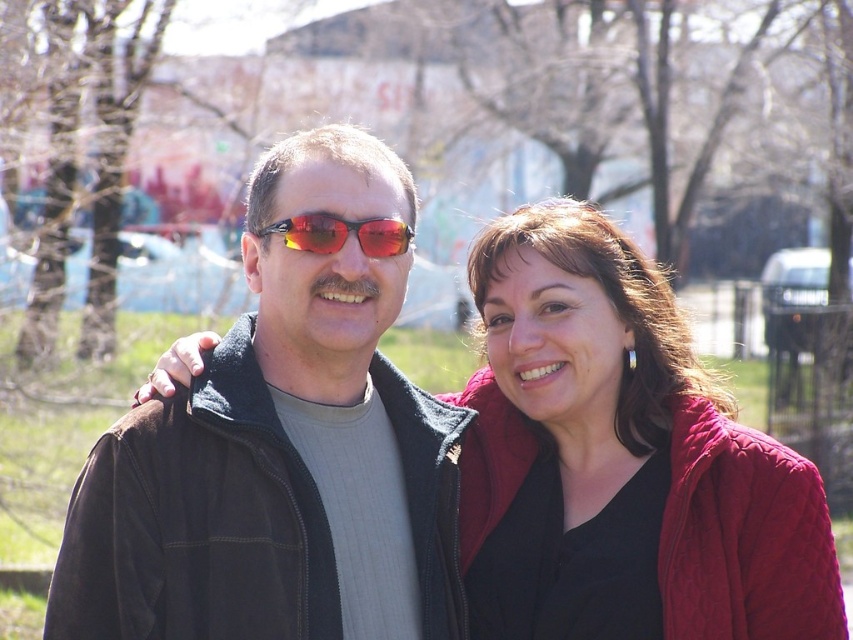
Is matte black jacket at center smaller than quilted red jacket at center?

Yes, matte black jacket at center is smaller than quilted red jacket at center.

Which is more to the left, matte black jacket at center or quilted red jacket at center?

From the viewer's perspective, matte black jacket at center appears more on the left side.

Between point (74, 602) and point (490, 568), which one is positioned in front?

Point (74, 602) is in front.

At what (x,y) coordinates should I click in order to perform the action: click on matte black jacket at center. Please return your answer as a coordinate pair (x, y). The width and height of the screenshot is (853, 640). Looking at the image, I should click on (280, 451).

Consider the image. Is matte black jacket at center positioned before shiny red plastic sunglasses at center?

Yes, it is in front of shiny red plastic sunglasses at center.

Does matte black jacket at center have a lesser width compared to shiny red plastic sunglasses at center?

No, matte black jacket at center is not thinner than shiny red plastic sunglasses at center.

Based on the photo, who is more forward, (405, 182) or (312, 224)?

Point (312, 224) is more forward.

At what (x,y) coordinates should I click in order to perform the action: click on matte black jacket at center. Please return your answer as a coordinate pair (x, y). Looking at the image, I should click on (280, 451).

Does quilted red jacket at center appear on the left side of shiny red plastic sunglasses at center?

In fact, quilted red jacket at center is to the right of shiny red plastic sunglasses at center.

Is the position of quilted red jacket at center more distant than that of shiny red plastic sunglasses at center?

No, it is not.

What do you see at coordinates (630, 472) in the screenshot? This screenshot has height=640, width=853. I see `quilted red jacket at center` at bounding box center [630, 472].

Locate an element on the screen. This screenshot has width=853, height=640. quilted red jacket at center is located at coordinates (630, 472).